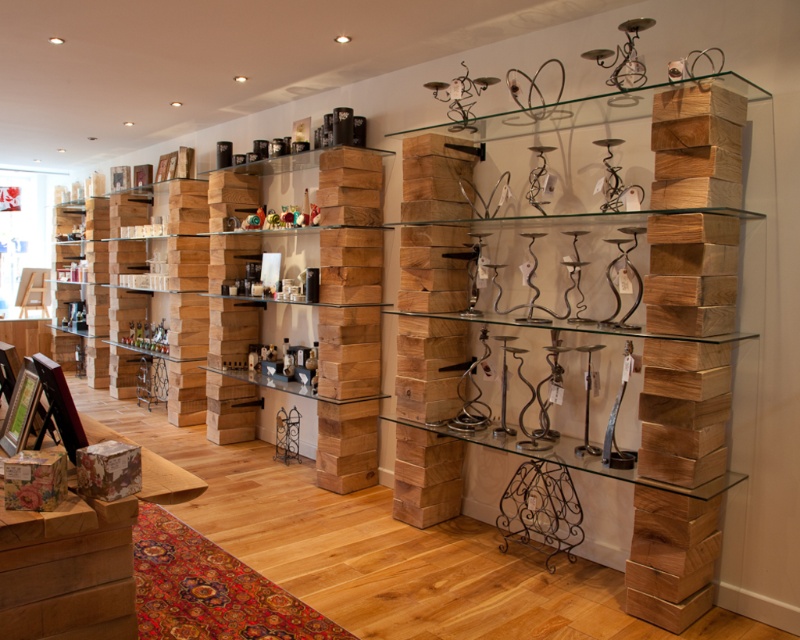
You are a delivery person who needs to place a large package that is 1.5 meters long into the space between the natural wood bookshelf at upper right and the wooden shelves at center. Will the package fit in that space?

The space between the natural wood bookshelf at upper right and the wooden shelves at center is 1.47 meters. Since the package is 1.5 meters long, it will not fit in the available space.

You are a delivery person carrying a camera that needs to be placed on the natural wood bookshelf at upper right. The camera is 8 feet long. Can you place the camera on the bookshelf without moving it?

The distance between the natural wood bookshelf at upper right and the camera is 7.77 feet. Since the camera is 8 feet long, it is longer than the available space, so it cannot be placed on the bookshelf without moving it.